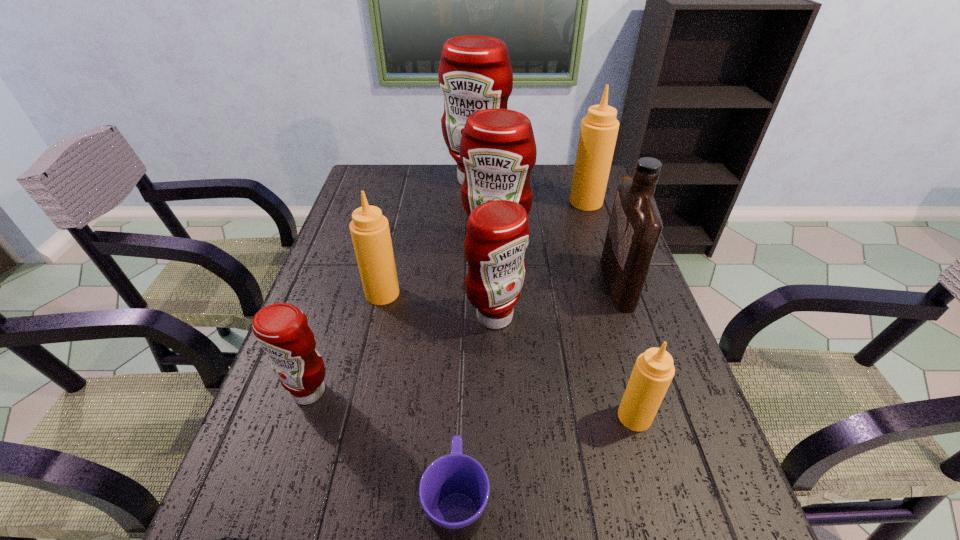
I want to click on the biggest red condiment, so click(x=475, y=73).

This screenshot has width=960, height=540. Find the location of `the farthest red condiment`. the farthest red condiment is located at coordinates (475, 73).

You are a GUI agent. You are given a task and a screenshot of the screen. Output one action in this format:
    pyautogui.click(x=<x>, y=<y>)
    Task: Click on the second farthest red condiment
    The image size is (960, 540).
    Given the screenshot: What is the action you would take?
    pyautogui.click(x=498, y=150)

This screenshot has height=540, width=960. In order to click on the second biggest red condiment in this screenshot , I will do `click(498, 150)`.

Locate an element on the screen. Image resolution: width=960 pixels, height=540 pixels. the biggest tan condiment is located at coordinates (598, 132).

This screenshot has height=540, width=960. In order to click on liquor in this screenshot , I will do `click(635, 225)`.

Locate an element on the screen. This screenshot has height=540, width=960. the second nearest tan condiment is located at coordinates (369, 229).

Identify the location of the leftmost tan condiment. (369, 229).

I want to click on the third biggest red condiment, so click(x=498, y=233).

You are a GUI agent. You are given a task and a screenshot of the screen. Output one action in this format:
    pyautogui.click(x=<x>, y=<y>)
    Task: Click on the nearest tan condiment
    
    Given the screenshot: What is the action you would take?
    pyautogui.click(x=653, y=371)